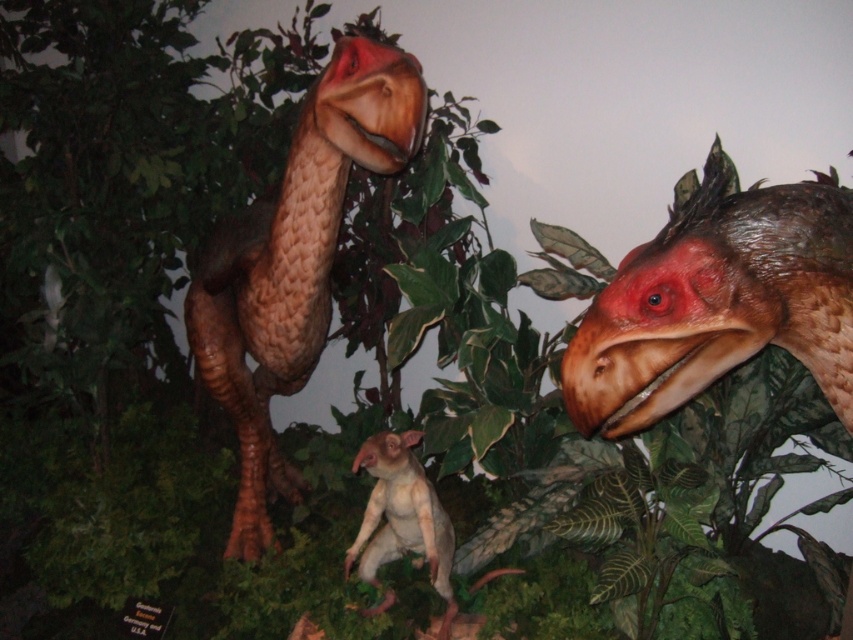
Which is above, brown textured dinosaur head at upper right or smooth beige animal at center?

Positioned higher is brown textured dinosaur head at upper right.

Between point (815, 340) and point (370, 582), which one is positioned in front?

Point (815, 340) is more forward.

Is point (733, 284) positioned after point (428, 580)?

No, it is not.

You are a GUI agent. You are given a task and a screenshot of the screen. Output one action in this format:
    pyautogui.click(x=<x>, y=<y>)
    Task: Click on the brown textured dinosaur head at upper right
    The image size is (853, 640).
    Given the screenshot: What is the action you would take?
    pyautogui.click(x=718, y=301)

Is brown textured dinosaur head at upper right to the right of brown textured dinosaur at center from the viewer's perspective?

Indeed, brown textured dinosaur head at upper right is positioned on the right side of brown textured dinosaur at center.

Which is in front, point (585, 378) or point (242, 273)?

Point (585, 378) is in front.

The height and width of the screenshot is (640, 853). I want to click on brown textured dinosaur head at upper right, so click(718, 301).

Is point (233, 234) in front of point (405, 451)?

No, it is not.

Is brown textured dinosaur at center smaller than smooth beige animal at center?

No.

You are a GUI agent. You are given a task and a screenshot of the screen. Output one action in this format:
    pyautogui.click(x=<x>, y=<y>)
    Task: Click on the brown textured dinosaur at center
    Image resolution: width=853 pixels, height=640 pixels.
    Given the screenshot: What is the action you would take?
    pyautogui.click(x=293, y=262)